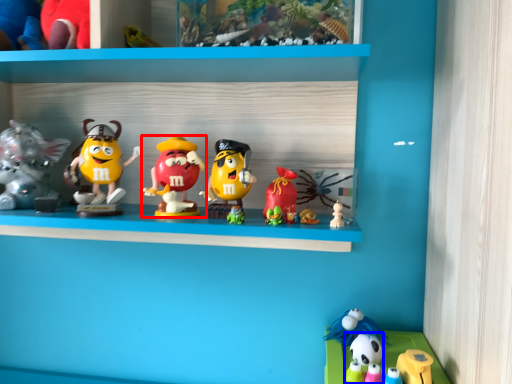
Question: Which object appears closest to the camera in this image, toy (highlighted by a red box) or toy (highlighted by a blue box)?

Choices:
 (A) toy
 (B) toy

Answer: (B)